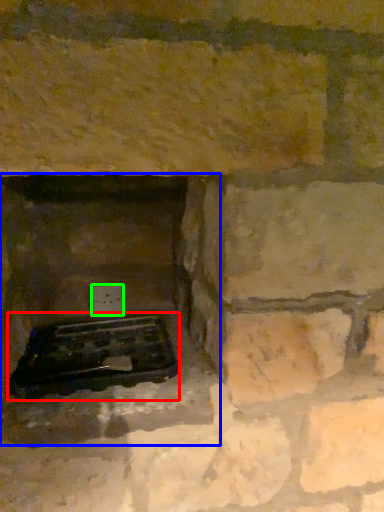
Question: Estimate the real-world distances between objects in this image. Which object is farther from grill (highlighted by a red box), fireplace (highlighted by a blue box) or electric outlet (highlighted by a green box)?

Choices:
 (A) fireplace
 (B) electric outlet

Answer: (B)